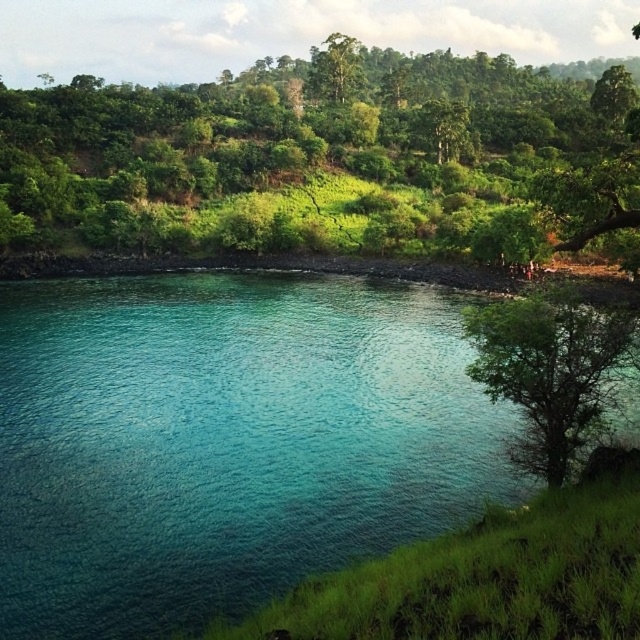
Who is shorter, green leafy tree at center or green leafy tree at lower right?

green leafy tree at lower right

Between point (170, 200) and point (616, 314), which one is positioned behind?

Positioned behind is point (170, 200).

Identify the location of green leafy tree at center. (310, 140).

Which is more to the right, teal glossy water at center or green leafy tree at center?

From the viewer's perspective, green leafy tree at center appears more on the right side.

Who is more forward, (12,419) or (522,99)?

Point (12,419)

Who is more forward, (360, 307) or (0, 189)?

Point (360, 307) is in front.

Identify the location of teal glossy water at center. The height and width of the screenshot is (640, 640). (227, 442).

Does teal glossy water at center have a lesser width compared to green leafy tree at lower right?

In fact, teal glossy water at center might be wider than green leafy tree at lower right.

Is point (125, 452) positioned behind point (554, 307)?

That is True.

The image size is (640, 640). Identify the location of teal glossy water at center. (227, 442).